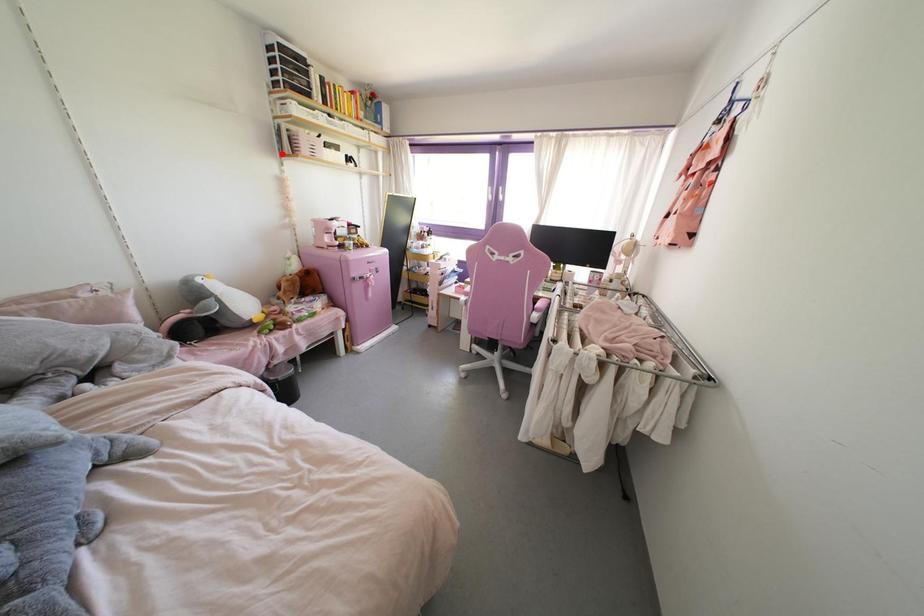
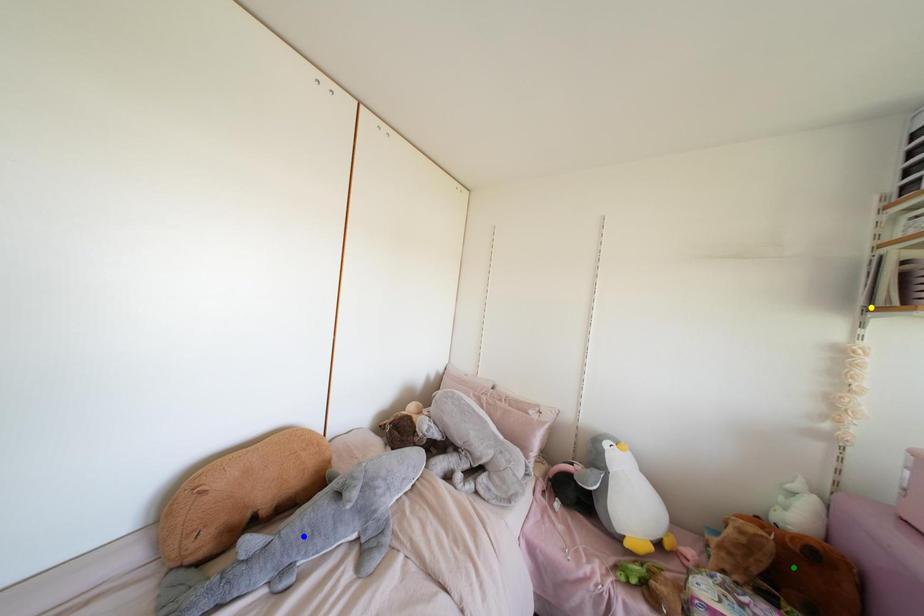
Question: I am providing you with two images of the same scene from different viewpoints. A red point is marked on the first image. You are given multiple points on the second image. Which spot in image 2 lines up with the point in image 1?

Choices:
 (A) blue point
 (B) green point
 (C) yellow point

Answer: (C)